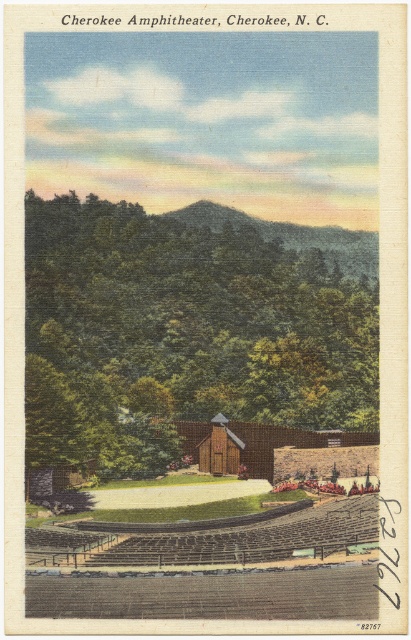
Question: Among these points, which one is farthest from the camera?

Choices:
 (A) (224, 216)
 (B) (223, 381)

Answer: (A)

Question: Can you confirm if green leafy tree at center is thinner than green textured hillside at center?

Choices:
 (A) yes
 (B) no

Answer: (B)

Question: Does green leafy tree at center appear on the right side of green textured hillside at center?

Choices:
 (A) yes
 (B) no

Answer: (B)

Question: Observing the image, what is the correct spatial positioning of green leafy tree at center in reference to green textured hillside at center?

Choices:
 (A) above
 (B) below

Answer: (B)